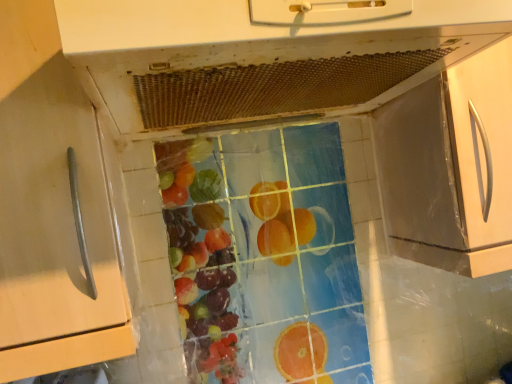
What do you see at coordinates (264, 55) in the screenshot? The image size is (512, 384). I see `metallic mesh vent at upper center` at bounding box center [264, 55].

Find the location of `metallic mesh vent at upper center`. metallic mesh vent at upper center is located at coordinates (264, 55).

Measure the distance between metallic mesh vent at upper center and camera.

metallic mesh vent at upper center and camera are 16.74 inches apart from each other.

Image resolution: width=512 pixels, height=384 pixels. Find the location of `metallic mesh vent at upper center`. metallic mesh vent at upper center is located at coordinates (264, 55).